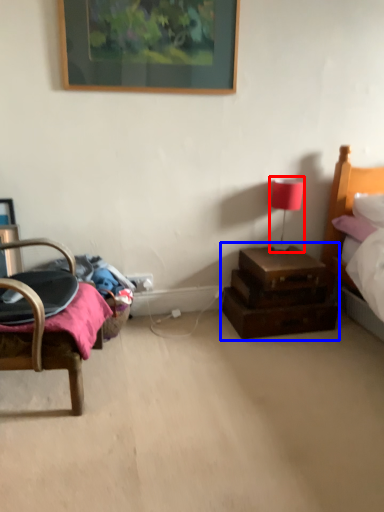
Question: Which object is further to the camera taking this photo, table lamp (highlighted by a red box) or nightstand (highlighted by a blue box)?

Choices:
 (A) table lamp
 (B) nightstand

Answer: (A)